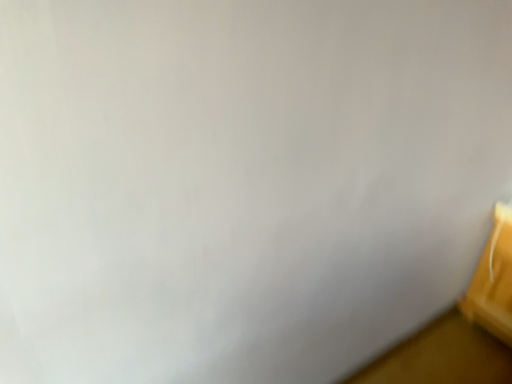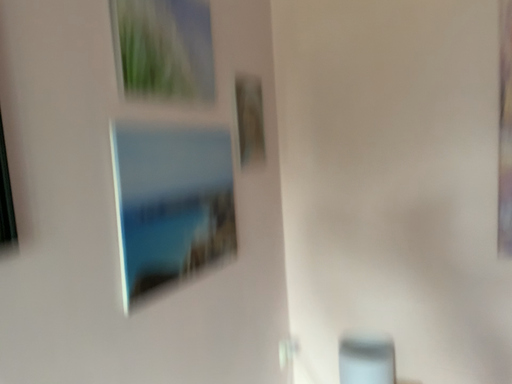
Question: Which way did the camera rotate in the video?

Choices:
 (A) rotated right
 (B) rotated left

Answer: (A)